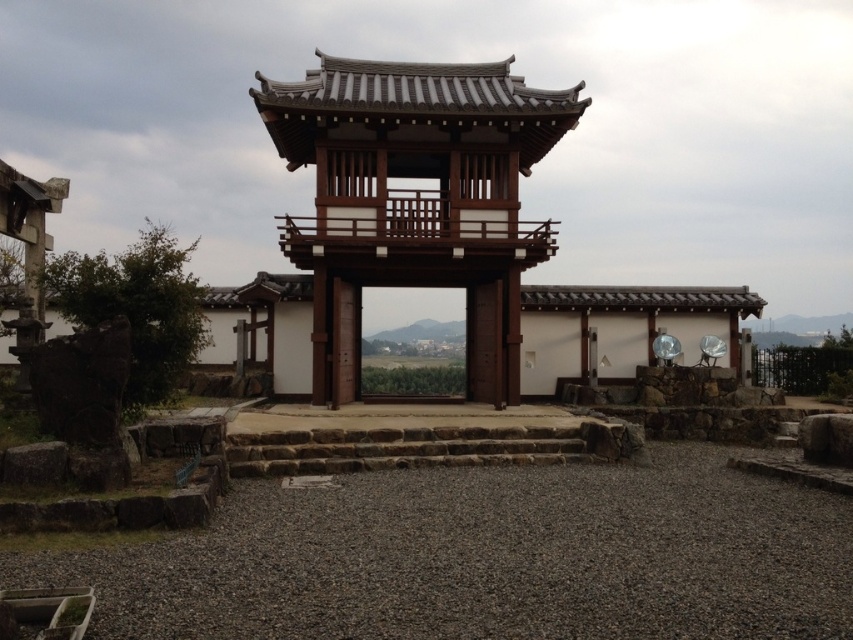
I want to click on brown wooden gazebo at center, so click(415, 198).

Is brown wooden gazebo at center to the right of brown stone stairs at center from the viewer's perspective?

Indeed, brown wooden gazebo at center is positioned on the right side of brown stone stairs at center.

Where is `brown wooden gazebo at center`? The height and width of the screenshot is (640, 853). brown wooden gazebo at center is located at coordinates (415, 198).

Locate an element on the screen. gray gravel at center is located at coordinates (480, 557).

Is point (22, 561) positioned after point (547, 452)?

No, it is not.

Who is more distant from viewer, (650, 540) or (529, 435)?

Positioned behind is point (529, 435).

The image size is (853, 640). I want to click on gray gravel at center, so click(x=480, y=557).

Between point (32, 561) and point (519, 84), which one is positioned in front?

Point (32, 561) is more forward.

Which of these two, gray gravel at center or brown wooden gazebo at center, stands shorter?

With less height is gray gravel at center.

Measure the distance between point (x=331, y=540) and camera.

They are 27.95 feet apart.

Where is `gray gravel at center`? The width and height of the screenshot is (853, 640). gray gravel at center is located at coordinates (480, 557).